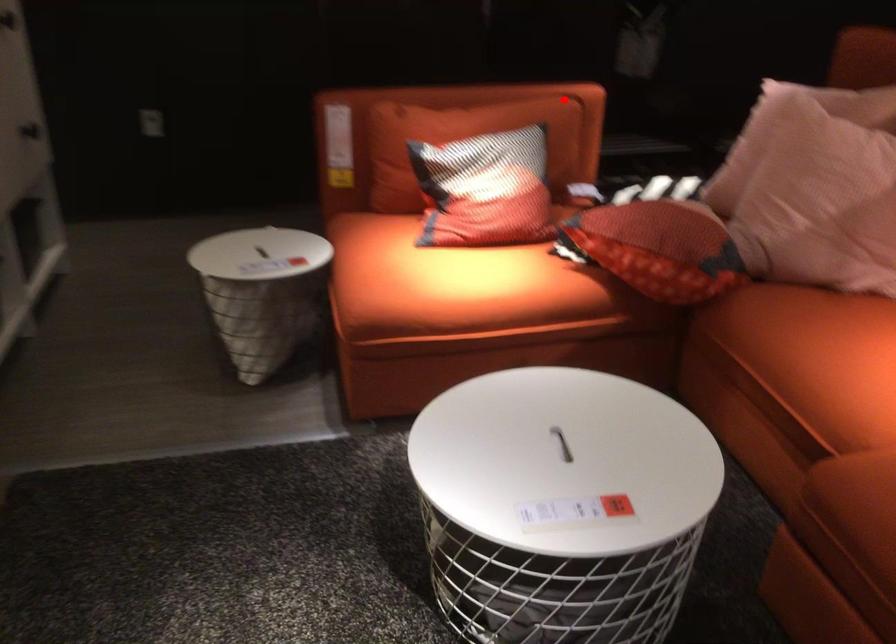
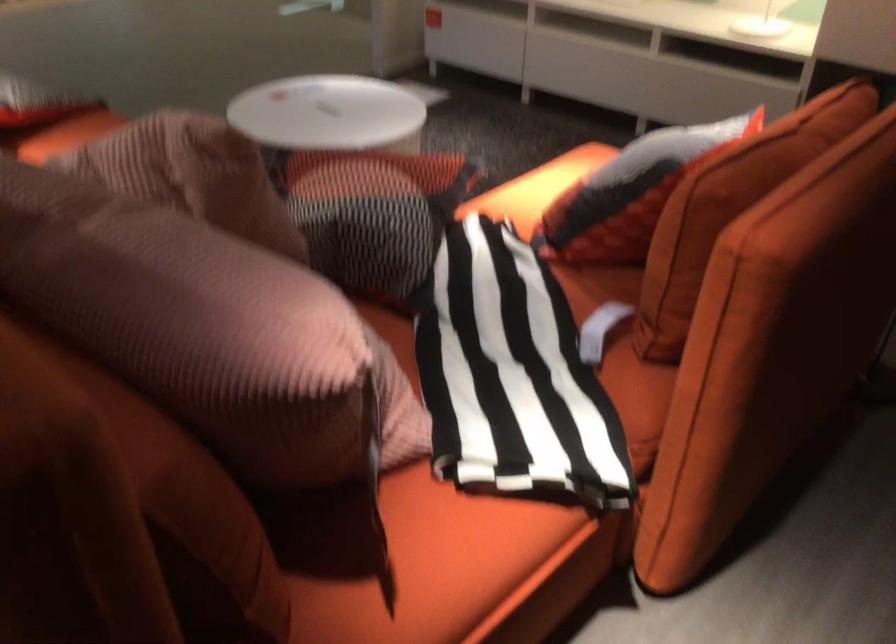
The point at the highlighted location is marked in the first image. Where is the corresponding point in the second image?

(730, 207)